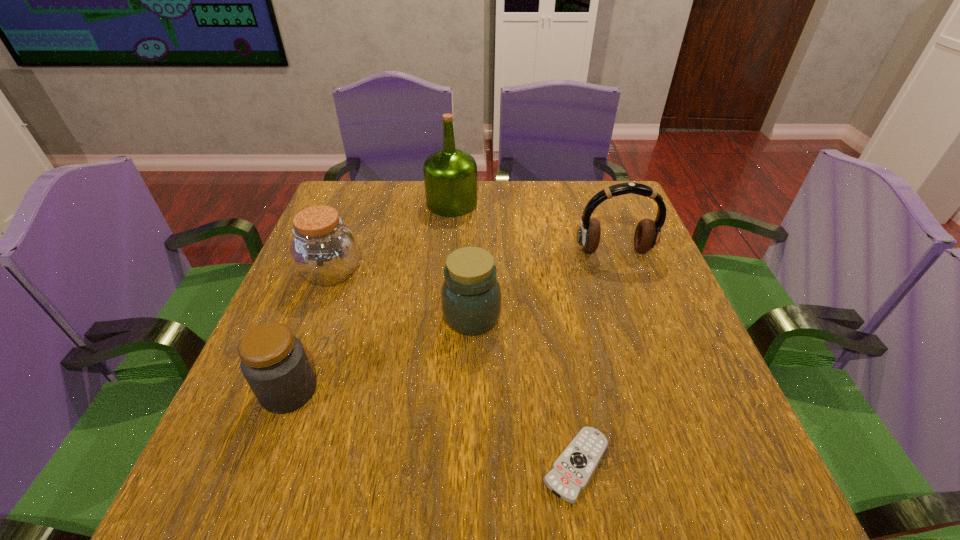
Locate an element on the screen. Image resolution: width=960 pixels, height=540 pixels. vacant area at the near edge of the desktop is located at coordinates (643, 463).

In the image, there is a desktop. Identify the location of free region at the left edge. [346, 322].

Where is `vacant region at the right edge`? This screenshot has width=960, height=540. vacant region at the right edge is located at coordinates (606, 242).

At what (x,y) coordinates should I click in order to perform the action: click on vacant point at the far left corner. Please return your answer as a coordinate pair (x, y). Looking at the image, I should click on (372, 201).

What are the coordinates of `vacant space at the far right corner of the desktop` in the screenshot? It's located at (585, 202).

This screenshot has width=960, height=540. In order to click on empty location between the farthest jar and the second nearest object in this screenshot , I will do `click(310, 332)`.

Locate an element on the screen. The image size is (960, 540). unoccupied area between the second tallest object and the fourth farthest object is located at coordinates (543, 284).

You are a GUI agent. You are given a task and a screenshot of the screen. Output one action in this format:
    pyautogui.click(x=<x>, y=<y>)
    Task: Click on the empty space between the fifth object from left to right and the second farthest jar
    The image size is (960, 540).
    Given the screenshot: What is the action you would take?
    pyautogui.click(x=524, y=391)

The width and height of the screenshot is (960, 540). What are the coordinates of `vacant space in between the nearest jar and the farthest jar` in the screenshot? It's located at click(310, 332).

I want to click on vacant point located between the second nearest jar and the farthest jar, so click(401, 295).